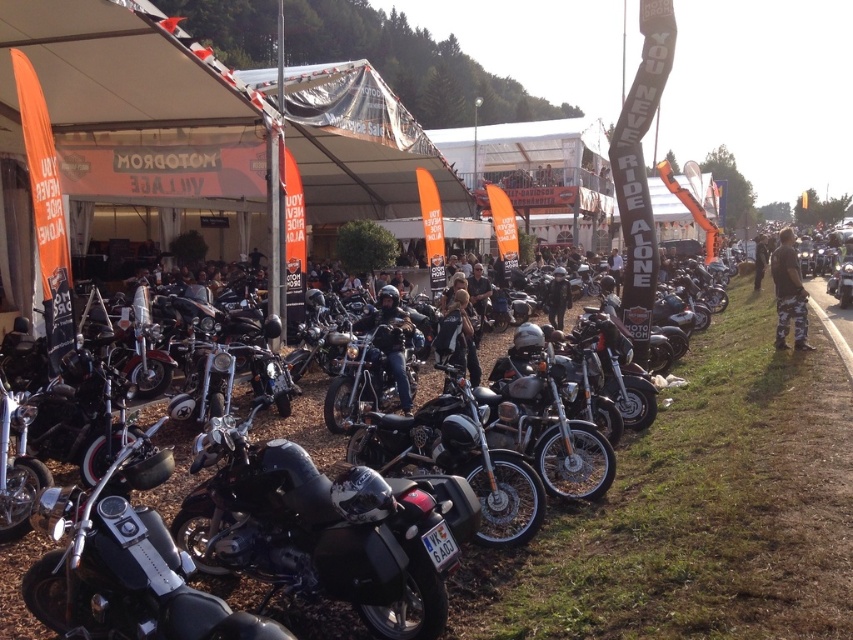
Question: Is black matte motorcycle at center above black leather jacket at center?

Choices:
 (A) no
 (B) yes

Answer: (A)

Question: Does black matte motorcycle at center have a greater width compared to black leather jacket at center?

Choices:
 (A) yes
 (B) no

Answer: (A)

Question: Which object appears farthest from the camera in this image?

Choices:
 (A) black leather jacket at center
 (B) polished chrome motorcycle at center

Answer: (A)

Question: Which of the following is the closest to the observer?

Choices:
 (A) polished chrome motorcycle at center
 (B) black leather jacket at center
 (C) black matte motorcycle at center

Answer: (A)

Question: Considering the relative positions of black matte motorcycle at center and black leather jacket at center in the image provided, where is black matte motorcycle at center located with respect to black leather jacket at center?

Choices:
 (A) below
 (B) above

Answer: (A)

Question: Which point is farther to the camera?

Choices:
 (A) (451, 506)
 (B) (67, 550)

Answer: (A)